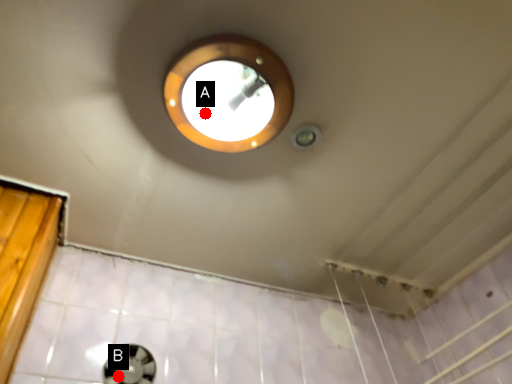
Question: Two points are circled on the image, labeled by A and B beside each circle. Which point is farther to the camera?

Choices:
 (A) A is further
 (B) B is further

Answer: (B)